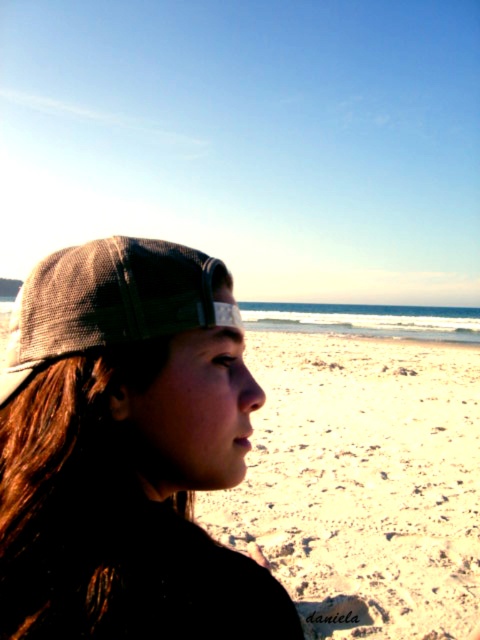
Question: Which point appears closest to the camera in this image?

Choices:
 (A) (67, 349)
 (B) (162, 252)

Answer: (A)

Question: Is brown mesh cap at left smaller than gray mesh baseball cap at left?

Choices:
 (A) yes
 (B) no

Answer: (A)

Question: Which point appears closest to the camera in this image?

Choices:
 (A) (2, 342)
 (B) (12, 472)

Answer: (B)

Question: Which point is farther to the camera?

Choices:
 (A) (214, 284)
 (B) (133, 316)

Answer: (A)

Question: Is brown mesh cap at left bigger than gray mesh baseball cap at left?

Choices:
 (A) yes
 (B) no

Answer: (B)

Question: Can you confirm if brown mesh cap at left is positioned below gray mesh baseball cap at left?

Choices:
 (A) no
 (B) yes

Answer: (A)